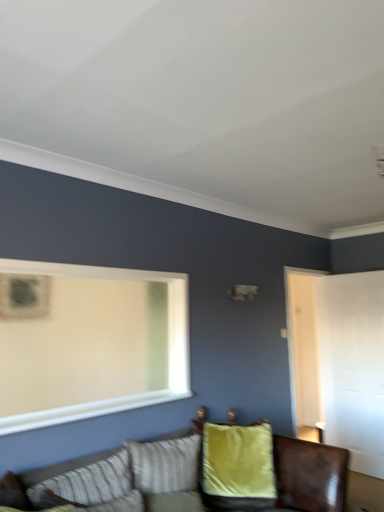
How much space does striped fabric pillow at lower left, acting as the 1th pillow starting from the left, occupy vertically?

striped fabric pillow at lower left, acting as the 1th pillow starting from the left, is 12.05 inches tall.

The height and width of the screenshot is (512, 384). What do you see at coordinates (238, 461) in the screenshot?
I see `velvet yellow pillow at center, which is counted as the second pillow, starting from the front` at bounding box center [238, 461].

At what (x,y) coordinates should I click in order to perform the action: click on striped fabric pillow at lower left, which is counted as the 1th pillow, starting from the front. Please return your answer as a coordinate pair (x, y). This screenshot has width=384, height=512. Looking at the image, I should click on (89, 481).

From a real-world perspective, who is located lower, striped fabric pillow at lower left, acting as the 1th pillow starting from the left, or velvet yellow pillow at center, which is counted as the 2th pillow, starting from the left?

From a 3D spatial view, velvet yellow pillow at center, which is counted as the 2th pillow, starting from the left, is below.

Consider the image. Does striped fabric pillow at lower left, acting as the 1th pillow starting from the left, appear on the right side of velvet yellow pillow at center, the 1th pillow from the right?

Incorrect, striped fabric pillow at lower left, acting as the 1th pillow starting from the left, is not on the right side of velvet yellow pillow at center, the 1th pillow from the right.

Between striped fabric pillow at lower left, the 2th pillow in the back-to-front sequence, and velvet yellow pillow at center, which is counted as the second pillow, starting from the front, which one has less height?

Standing shorter between the two is striped fabric pillow at lower left, the 2th pillow in the back-to-front sequence.

Does striped fabric pillow at lower left, the 2th pillow in the back-to-front sequence, turn towards velvet yellow pillow at center, which is counted as the 2th pillow, starting from the left?

No, striped fabric pillow at lower left, the 2th pillow in the back-to-front sequence, is not aimed at velvet yellow pillow at center, which is counted as the 2th pillow, starting from the left.

Is striped fabric pillow at lower left, acting as the 1th pillow starting from the left, thinner than velvet green couch at lower center?

Yes, striped fabric pillow at lower left, acting as the 1th pillow starting from the left, is thinner than velvet green couch at lower center.

From a real-world perspective, which object rests below the other?

In real-world perspective, velvet green couch at lower center is lower.

Can you tell me how much striped fabric pillow at lower left, the 2th pillow in the back-to-front sequence, and velvet green couch at lower center differ in facing direction?

0.000295 degrees separate the facing orientations of striped fabric pillow at lower left, the 2th pillow in the back-to-front sequence, and velvet green couch at lower center.

Does striped fabric pillow at lower left, the 2th pillow in the back-to-front sequence, appear on the right side of velvet green couch at lower center?

No, striped fabric pillow at lower left, the 2th pillow in the back-to-front sequence, is not to the right of velvet green couch at lower center.

Which is correct: velvet yellow pillow at center, which is counted as the second pillow, starting from the front, is inside striped fabric pillow at lower left, which is the second pillow in right-to-left order, or outside of it?

velvet yellow pillow at center, which is counted as the second pillow, starting from the front, is not enclosed by striped fabric pillow at lower left, which is the second pillow in right-to-left order.

Does velvet yellow pillow at center, which is counted as the second pillow, starting from the front, turn towards striped fabric pillow at lower left, which is the second pillow in right-to-left order?

No, velvet yellow pillow at center, which is counted as the second pillow, starting from the front, does not turn towards striped fabric pillow at lower left, which is the second pillow in right-to-left order.

Is velvet yellow pillow at center, marked as the 1th pillow in a back-to-front arrangement, touching striped fabric pillow at lower left, which is counted as the 1th pillow, starting from the front?

There is a gap between velvet yellow pillow at center, marked as the 1th pillow in a back-to-front arrangement, and striped fabric pillow at lower left, which is counted as the 1th pillow, starting from the front.

Locate an element on the screen. This screenshot has height=512, width=384. pillow located on the right of striped fabric pillow at lower left, which is the second pillow in right-to-left order is located at coordinates (238, 461).

Looking at this image, which of these two, velvet green couch at lower center or striped fabric pillow at lower left, which is the second pillow in right-to-left order, is thinner?

striped fabric pillow at lower left, which is the second pillow in right-to-left order.

I want to click on pillow above the velvet green couch at lower center (from the image's perspective), so click(89, 481).

How many degrees apart are the facing directions of velvet green couch at lower center and striped fabric pillow at lower left, which is counted as the 1th pillow, starting from the front?

The facing directions of velvet green couch at lower center and striped fabric pillow at lower left, which is counted as the 1th pillow, starting from the front, are 0.000295 degrees apart.

Is velvet green couch at lower center situated inside striped fabric pillow at lower left, acting as the 1th pillow starting from the left, or outside?

velvet green couch at lower center exists outside the volume of striped fabric pillow at lower left, acting as the 1th pillow starting from the left.

Does point (238, 490) lie in front of point (94, 496)?

No, it is behind (94, 496).

Are velvet yellow pillow at center, which is counted as the 2th pillow, starting from the left, and velvet green couch at lower center located far from each other?

Actually, velvet yellow pillow at center, which is counted as the 2th pillow, starting from the left, and velvet green couch at lower center are a little close together.

From the image's perspective, is velvet yellow pillow at center, the 1th pillow from the right, located above velvet green couch at lower center?

Actually, velvet yellow pillow at center, the 1th pillow from the right, appears below velvet green couch at lower center in the image.

Looking at this image, what's the angular difference between velvet yellow pillow at center, which is counted as the second pillow, starting from the front, and velvet green couch at lower center's facing directions?

57.6 degrees.

Measure the distance between velvet green couch at lower center and velvet yellow pillow at center, which is counted as the 2th pillow, starting from the left.

velvet green couch at lower center and velvet yellow pillow at center, which is counted as the 2th pillow, starting from the left, are 6.23 inches apart from each other.

Is velvet green couch at lower center far from velvet yellow pillow at center, which is counted as the 2th pillow, starting from the left?

velvet green couch at lower center is actually quite close to velvet yellow pillow at center, which is counted as the 2th pillow, starting from the left.

Looking at the image, does velvet green couch at lower center seem bigger or smaller compared to velvet yellow pillow at center, marked as the 1th pillow in a back-to-front arrangement?

Considering their sizes, velvet green couch at lower center takes up more space than velvet yellow pillow at center, marked as the 1th pillow in a back-to-front arrangement.

This screenshot has width=384, height=512. I want to click on studio couch in front of the velvet yellow pillow at center, marked as the 1th pillow in a back-to-front arrangement, so click(192, 475).

Image resolution: width=384 pixels, height=512 pixels. In the image, there is a velvet yellow pillow at center, marked as the 1th pillow in a back-to-front arrangement. What are the coordinates of `pillow above it (from the image's perspective)` in the screenshot? It's located at (89, 481).

At what (x,y) coordinates should I click in order to perform the action: click on studio couch that appears on the right of striped fabric pillow at lower left, acting as the 1th pillow starting from the left. Please return your answer as a coordinate pair (x, y). This screenshot has width=384, height=512. Looking at the image, I should click on (192, 475).

Estimate the real-world distances between objects in this image. Which object is closer to velvet green couch at lower center, striped fabric pillow at lower left, which is the second pillow in right-to-left order, or velvet yellow pillow at center, marked as the 1th pillow in a back-to-front arrangement?

velvet yellow pillow at center, marked as the 1th pillow in a back-to-front arrangement, lies closer to velvet green couch at lower center than the other object.

Looking at the image, which one is located further to velvet yellow pillow at center, which is counted as the second pillow, starting from the front, velvet green couch at lower center or striped fabric pillow at lower left, which is counted as the 1th pillow, starting from the front?

striped fabric pillow at lower left, which is counted as the 1th pillow, starting from the front.

Which object lies nearer to the anchor point velvet yellow pillow at center, which is counted as the second pillow, starting from the front, striped fabric pillow at lower left, acting as the 1th pillow starting from the left, or velvet green couch at lower center?

The object closer to velvet yellow pillow at center, which is counted as the second pillow, starting from the front, is velvet green couch at lower center.

When comparing their distances from striped fabric pillow at lower left, which is the second pillow in right-to-left order, does velvet yellow pillow at center, which is counted as the second pillow, starting from the front, or velvet green couch at lower center seem closer?

velvet green couch at lower center is closer to striped fabric pillow at lower left, which is the second pillow in right-to-left order.

Which object lies further to the anchor point velvet green couch at lower center, velvet yellow pillow at center, the 1th pillow from the right, or striped fabric pillow at lower left, acting as the 1th pillow starting from the left?

striped fabric pillow at lower left, acting as the 1th pillow starting from the left, is positioned further to the anchor velvet green couch at lower center.

Looking at the image, which one is located further to striped fabric pillow at lower left, the 2th pillow in the back-to-front sequence, velvet green couch at lower center or velvet yellow pillow at center, marked as the 1th pillow in a back-to-front arrangement?

velvet yellow pillow at center, marked as the 1th pillow in a back-to-front arrangement, is positioned further to the anchor striped fabric pillow at lower left, the 2th pillow in the back-to-front sequence.

At what (x,y) coordinates should I click in order to perform the action: click on pillow located between velvet green couch at lower center and velvet yellow pillow at center, which is counted as the second pillow, starting from the front, in the depth direction. Please return your answer as a coordinate pair (x, y). The image size is (384, 512). Looking at the image, I should click on (89, 481).